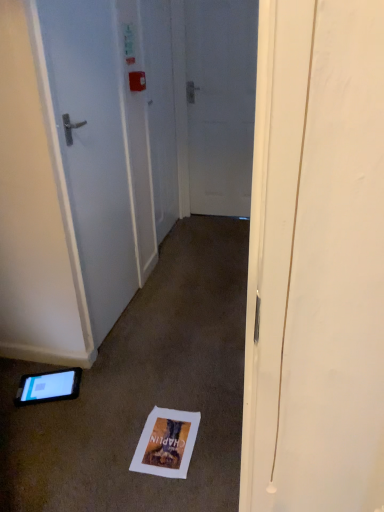
Where is `vacant region above white paper postcard at lower center (from a real-world perspective)`? This screenshot has width=384, height=512. vacant region above white paper postcard at lower center (from a real-world perspective) is located at coordinates (165, 440).